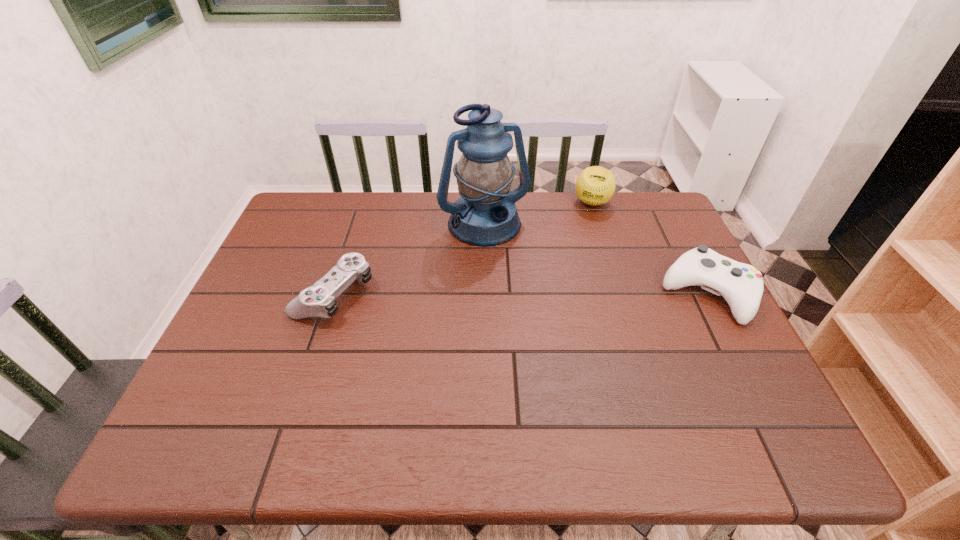
Find the location of a particular element. The width and height of the screenshot is (960, 540). vacant spot on the desktop that is between the leftmost object and the rightmost object and is positioned on the face of the lantern is located at coordinates (523, 293).

Identify the location of vacant space on the desktop that is between the leftmost object and the rightmost object and is positioned on the logo side of the third object from left to right. (574, 293).